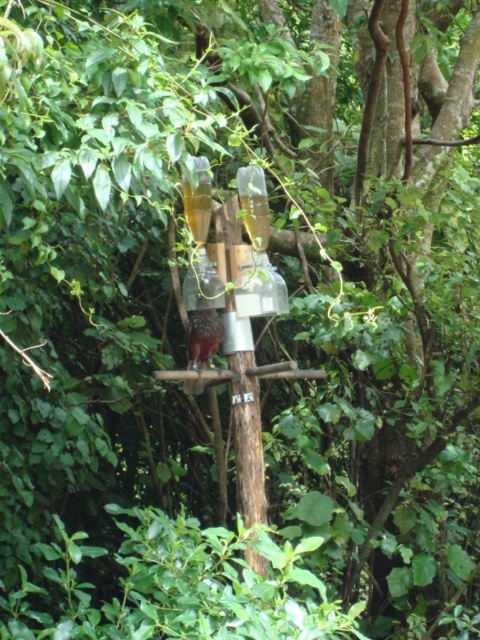
You are a bird flying towards the brown speckled feathers at center and the transparent glass bottle at center. Which object will you reach first?

The brown speckled feathers at center will be reached first because the transparent glass bottle at center is positioned to its right side, meaning it is further away from the starting point.

From the picture: You have a small bird that needs to drink from the transparent glass bottle at center. The bird is currently standing on the brown speckled feathers at center. Can the bird reach the bottle without moving its position?

The transparent glass bottle at center is wider than the brown speckled feathers at center, so the bird can reach the bottle without moving since the bottle is wider and likely within reach.